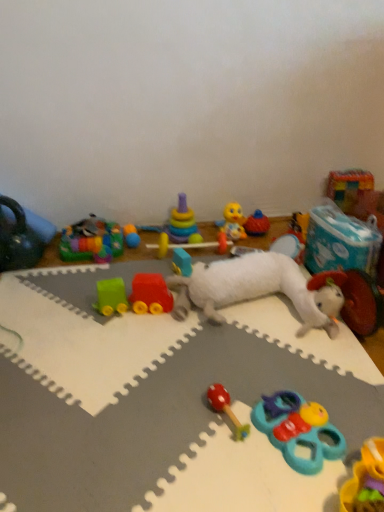
Question: In terms of height, does rubberized plastic toy at center, marked as the sixth toy in a left-to-right arrangement, look taller or shorter compared to stacked plastic rings at center, the 4th toy from the left?

Choices:
 (A) tall
 (B) short

Answer: (B)

Question: From a real-world perspective, is rubberized plastic toy at center, which is the tenth toy in right-to-left order, positioned above or below stacked plastic rings at center, which is the 12th toy from right to left?

Choices:
 (A) above
 (B) below

Answer: (B)

Question: Which object is positioned closest to the white plush toy at center, the eighth toy viewed from the left?

Choices:
 (A) blue rubber toy at lower right, which is the fifth toy in right-to-left order
 (B) yellow rubber duck at center, which is counted as the sixth toy, starting from the right
 (C) white plush lamb at center, the 13th toy viewed from the left
 (D) matte black kettlebell at left, the first toy from the left
 (E) rubber duck at center, the fourth toy positioned from the right

Answer: (A)

Question: Which object is positioned farthest from the multicolored plastic rainbow at upper left, the 2th toy when ordered from left to right?

Choices:
 (A) rubber duck at center, the 12th toy when ordered from left to right
 (B) plastic colorful blocks at upper right, which is the first toy in right-to-left order
 (C) white plush lamb at center, arranged as the 3th toy when viewed from the right
 (D) rubber block at center, arranged as the 11th toy when viewed from the right
 (E) matte black kettlebell at left, placed as the 15th toy when sorted from right to left

Answer: (B)